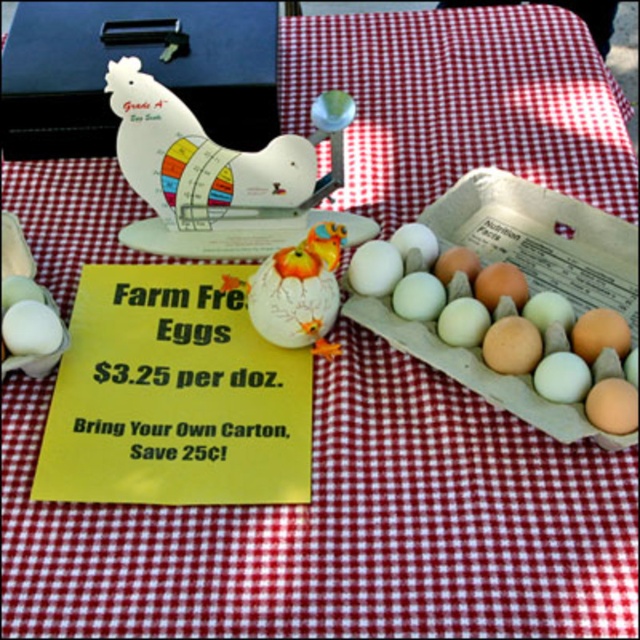
You are setting up a display at a farm stand and need to place the wooden at upper center and the white matte egg at center. Considering their sizes, which object should be placed on top to ensure stability?

The wooden at upper center should be placed on top because it has a greater height than the white matte egg at center, providing a more stable base.

From the picture: You are standing at the farm stand and want to pick up the eggs. The point where you need to reach is at coordinates point (330, 115). If your hand can extend 20 inches, can you reach that point?

The point (330, 115) is 22.34 inches away from the viewer. Since your hand can only extend 20 inches, you cannot reach that point.

You are setting up a farm stand and need to place the wooden at upper center and the matte plastic chicken at center. According to the scene, which object should be placed to the left of the other?

The wooden at upper center is positioned on the left side of matte plastic chicken at center, so the wooden at upper center should be placed to the left of the matte plastic chicken at center.